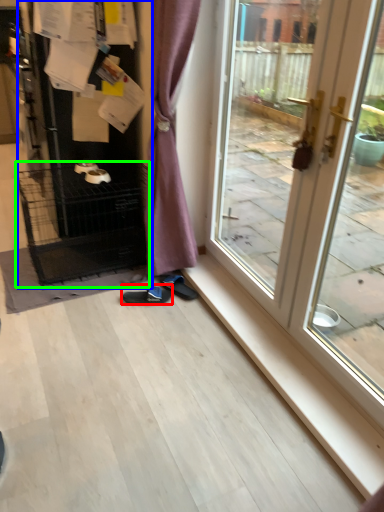
Question: Estimate the real-world distances between objects in this image. Which object is closer to footwear (highlighted by a red box), appliance (highlighted by a blue box) or cage (highlighted by a green box)?

Choices:
 (A) appliance
 (B) cage

Answer: (B)